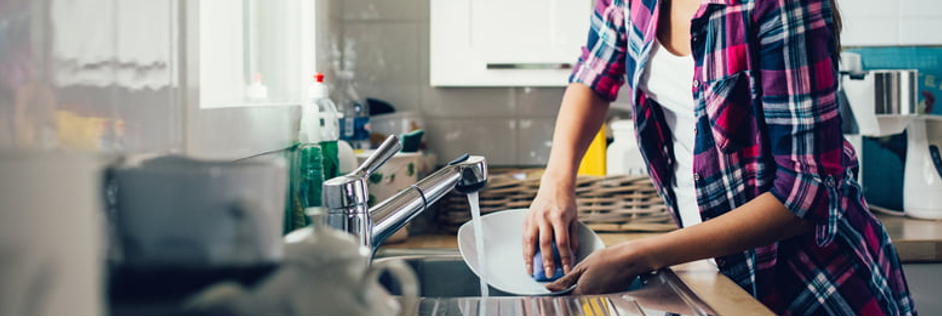
Locate an element on the screen. tap handle is located at coordinates (381, 153).